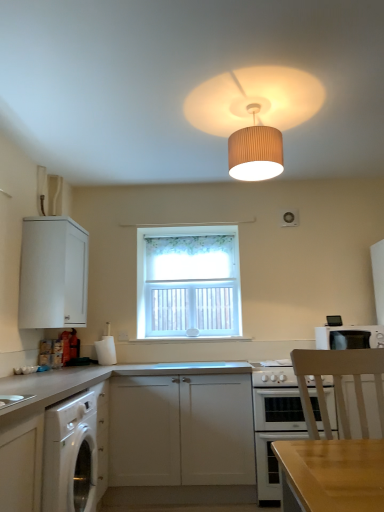
Question: Is white matte cabinet at lower left, positioned as the 3th cabinetry in back-to-front order, outside of floral fabric curtain at center?

Choices:
 (A) no
 (B) yes

Answer: (B)

Question: Would you say white matte cabinet at lower left, which appears as the 1th cabinetry when viewed from the front, contains floral fabric curtain at center?

Choices:
 (A) yes
 (B) no

Answer: (B)

Question: Are white matte cabinet at lower left, positioned as the 3th cabinetry in back-to-front order, and floral fabric curtain at center located far from each other?

Choices:
 (A) no
 (B) yes

Answer: (B)

Question: From the image's perspective, is white matte cabinet at lower left, which appears as the 1th cabinetry when viewed from the front, on top of floral fabric curtain at center?

Choices:
 (A) yes
 (B) no

Answer: (B)

Question: Is floral fabric curtain at center at the back of white matte cabinet at lower left, positioned as the 3th cabinetry in back-to-front order?

Choices:
 (A) no
 (B) yes

Answer: (A)

Question: Considering the relative sizes of white matte cabinet at lower left, positioned as the 3th cabinetry in back-to-front order, and floral fabric curtain at center in the image provided, is white matte cabinet at lower left, positioned as the 3th cabinetry in back-to-front order, bigger than floral fabric curtain at center?

Choices:
 (A) no
 (B) yes

Answer: (B)

Question: Is the depth of white matte cabinet at left, marked as the 3th cabinetry in a front-to-back arrangement, greater than that of white glossy exhaust hood at upper center?

Choices:
 (A) yes
 (B) no

Answer: (B)

Question: Considering the relative positions of white matte cabinet at left, marked as the 3th cabinetry in a front-to-back arrangement, and white glossy exhaust hood at upper center in the image provided, is white matte cabinet at left, marked as the 3th cabinetry in a front-to-back arrangement, in front of white glossy exhaust hood at upper center?

Choices:
 (A) no
 (B) yes

Answer: (B)

Question: Considering the relative positions of white matte cabinet at left, marked as the 3th cabinetry in a front-to-back arrangement, and white glossy exhaust hood at upper center in the image provided, is white matte cabinet at left, marked as the 3th cabinetry in a front-to-back arrangement, to the left of white glossy exhaust hood at upper center from the viewer's perspective?

Choices:
 (A) no
 (B) yes

Answer: (B)

Question: Does white matte cabinet at left, placed as the first cabinetry when sorted from back to front, have a greater width compared to white glossy exhaust hood at upper center?

Choices:
 (A) no
 (B) yes

Answer: (B)

Question: Is white glossy exhaust hood at upper center at the back of white matte cabinet at left, marked as the 3th cabinetry in a front-to-back arrangement?

Choices:
 (A) no
 (B) yes

Answer: (A)

Question: Is white matte cabinet at left, marked as the 3th cabinetry in a front-to-back arrangement, facing towards white glossy exhaust hood at upper center?

Choices:
 (A) no
 (B) yes

Answer: (B)

Question: Does white floral curtain at center appear on the right side of white matte cabinet at lower center, the 2th cabinetry viewed from the back?

Choices:
 (A) no
 (B) yes

Answer: (B)